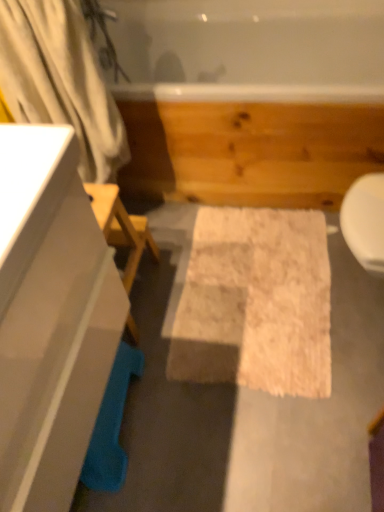
Question: From a real-world perspective, is white fluffy bath mat at center below white glossy cabinet at left?

Choices:
 (A) yes
 (B) no

Answer: (A)

Question: Does white fluffy bath mat at center appear on the left side of white glossy cabinet at left?

Choices:
 (A) yes
 (B) no

Answer: (B)

Question: Could you tell me if white fluffy bath mat at center is facing white glossy cabinet at left?

Choices:
 (A) yes
 (B) no

Answer: (B)

Question: Considering the relative sizes of white fluffy bath mat at center and white glossy cabinet at left in the image provided, is white fluffy bath mat at center taller than white glossy cabinet at left?

Choices:
 (A) no
 (B) yes

Answer: (A)

Question: Considering the relative sizes of white fluffy bath mat at center and white glossy cabinet at left in the image provided, is white fluffy bath mat at center smaller than white glossy cabinet at left?

Choices:
 (A) no
 (B) yes

Answer: (B)

Question: Is point (97, 100) closer or farther from the camera than point (135, 141)?

Choices:
 (A) closer
 (B) farther

Answer: (A)

Question: From the image's perspective, relative to white glossy tub at upper center, is white fabric shower curtain at left above or below?

Choices:
 (A) below
 (B) above

Answer: (A)

Question: From a real-world perspective, is white fabric shower curtain at left physically located above or below white glossy tub at upper center?

Choices:
 (A) above
 (B) below

Answer: (A)

Question: From their relative heights in the image, would you say white fabric shower curtain at left is taller or shorter than white glossy tub at upper center?

Choices:
 (A) short
 (B) tall

Answer: (B)

Question: Choose the correct answer: Is white glossy tub at upper center inside white glossy cabinet at left or outside it?

Choices:
 (A) outside
 (B) inside

Answer: (A)

Question: Is point (231, 71) positioned closer to the camera than point (41, 337)?

Choices:
 (A) closer
 (B) farther

Answer: (B)

Question: Is white glossy tub at upper center in front of or behind white glossy cabinet at left in the image?

Choices:
 (A) behind
 (B) front

Answer: (A)

Question: In terms of size, does white glossy tub at upper center appear bigger or smaller than white glossy cabinet at left?

Choices:
 (A) big
 (B) small

Answer: (A)

Question: From a real-world perspective, is white fabric shower curtain at left physically located above or below white glossy cabinet at left?

Choices:
 (A) below
 (B) above

Answer: (B)

Question: Is white fabric shower curtain at left inside the boundaries of white glossy cabinet at left, or outside?

Choices:
 (A) outside
 (B) inside

Answer: (A)